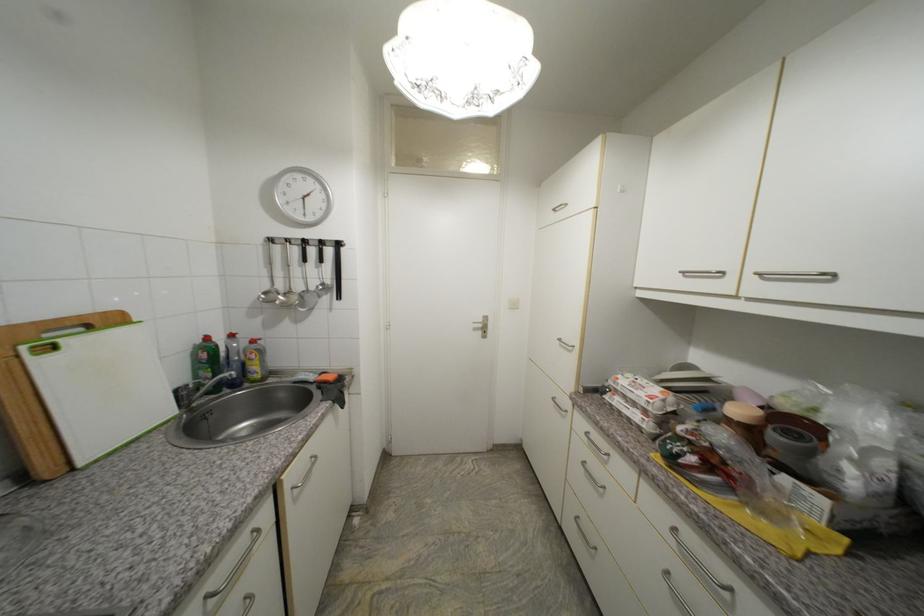
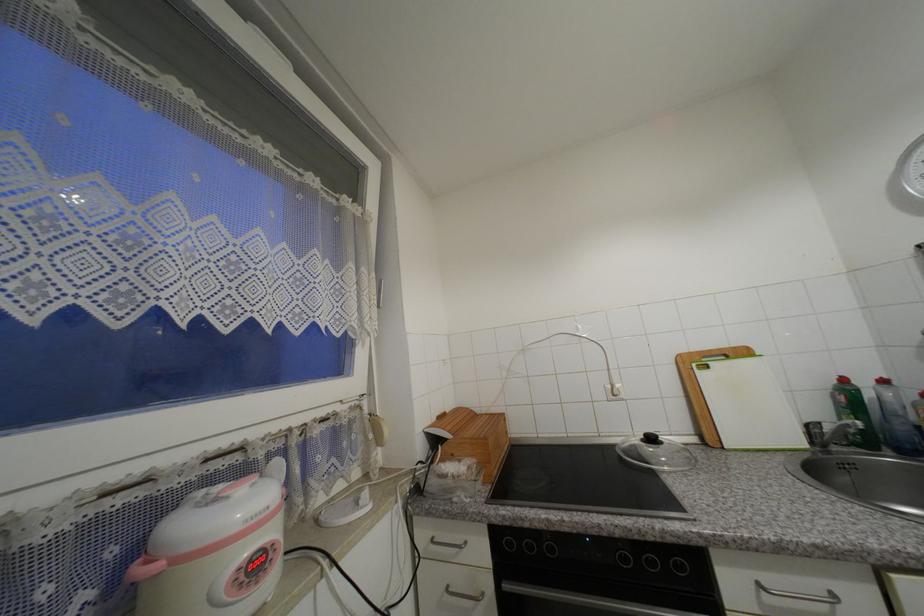
Question: The camera is either moving clockwise (left) or counter-clockwise (right) around the object. The first image is from the beginning of the video and the second image is from the end. Is the camera moving left or right when shooting the video?

Choices:
 (A) Left
 (B) Right

Answer: (B)